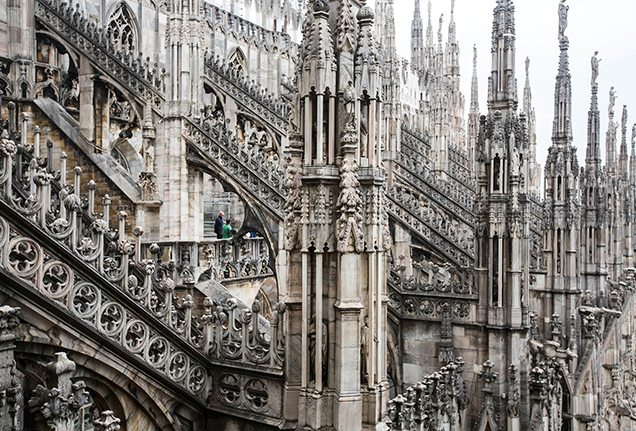
The width and height of the screenshot is (636, 431). In order to click on window in this screenshot , I will do `click(128, 36)`.